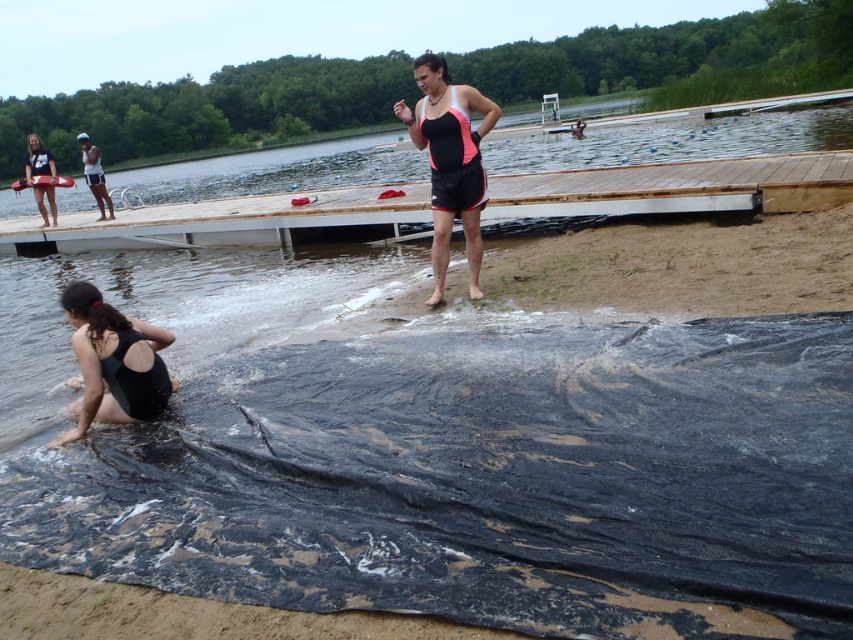
You are planning to build a small shed on the lakeside. The shed requires a space larger than the wooden dock at center. Is the matte black swimsuit at center a suitable location for the shed?

The wooden dock at center is bigger than the matte black swimsuit at center. Therefore, the matte black swimsuit at center is not a suitable location for the shed since it is smaller than the required space.

You are standing at point (171, 243) in the lakeside scene. If you want to take a photo of the wooden dock in the background, which is 42.58 feet away, what should you do to ensure the dock is in focus?

Since the wooden dock is 42.58 feet away from your current position at point (171, 243), you should adjust the focus of your camera to a distance of approximately 42.58 feet to ensure the dock appears sharp in the photo.

You are planning to walk from the wooden dock at center to the matte black life preserver at upper left. Which object is narrower, making the path potentially tricky?

The wooden dock at center is thinner than the matte black life preserver at upper left, so the wooden dock at center is narrower, making the path potentially tricky.